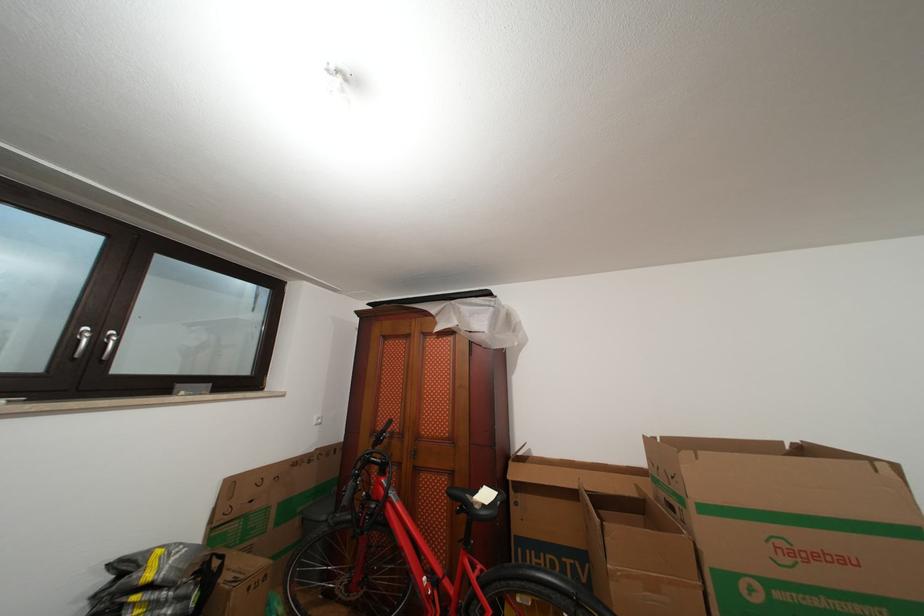
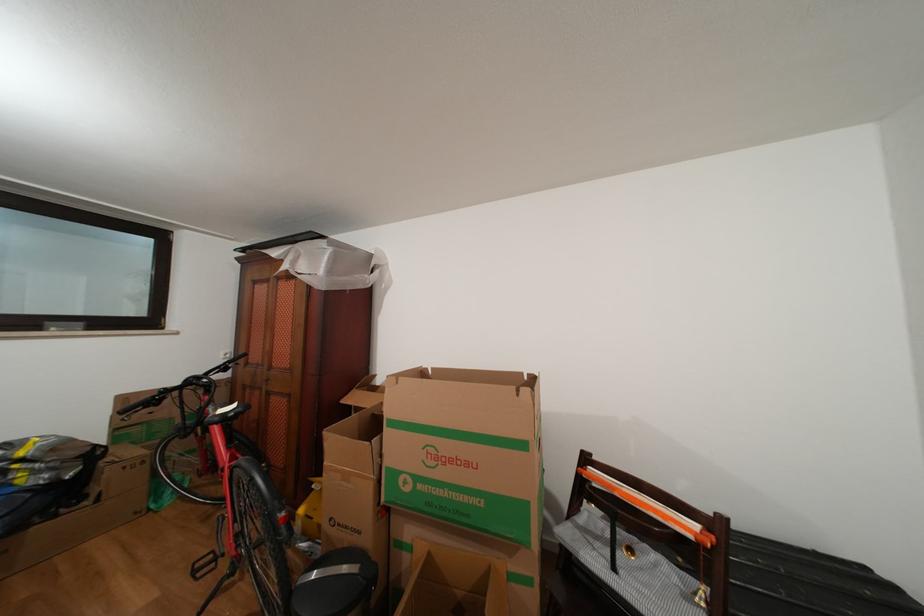
In the second image, find the point that corresponds to pixel 400 499 in the first image.

(219, 414)